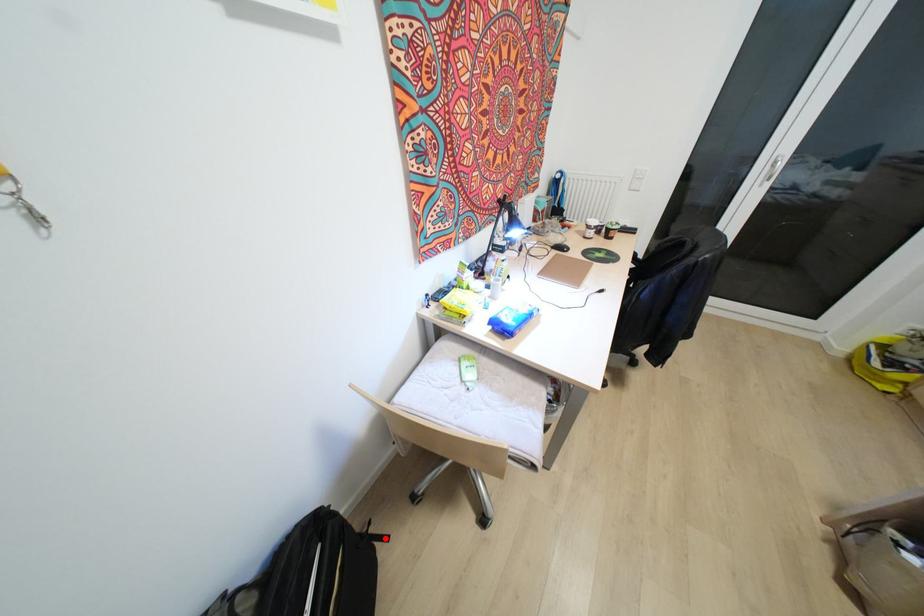
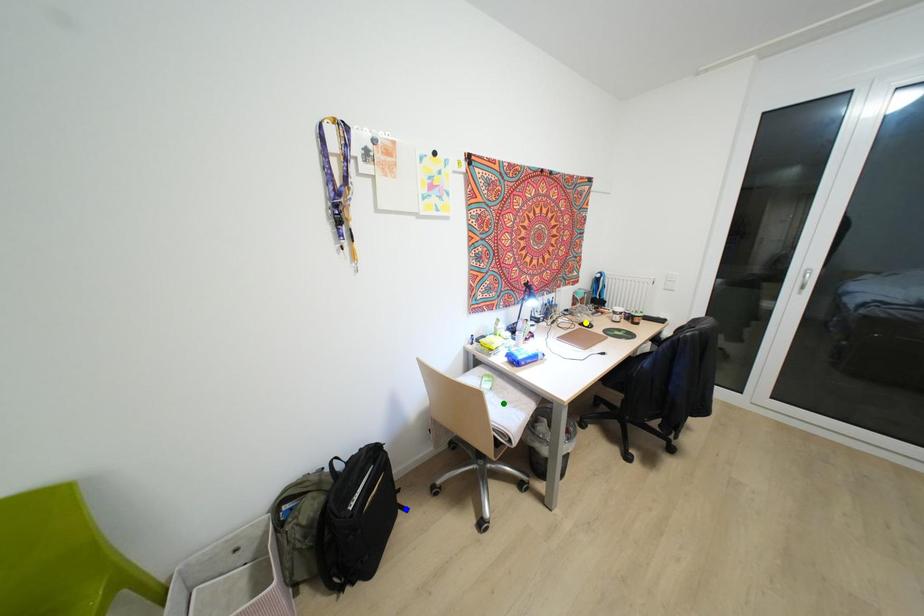
Question: I am providing you with two images of the same scene from different viewpoints. A red point is marked on the first image. You are given multiple points on the second image. Which point in image 2 represents the same 3d spot as the red point in image 1?

Choices:
 (A) blue point
 (B) yellow point
 (C) green point

Answer: (A)